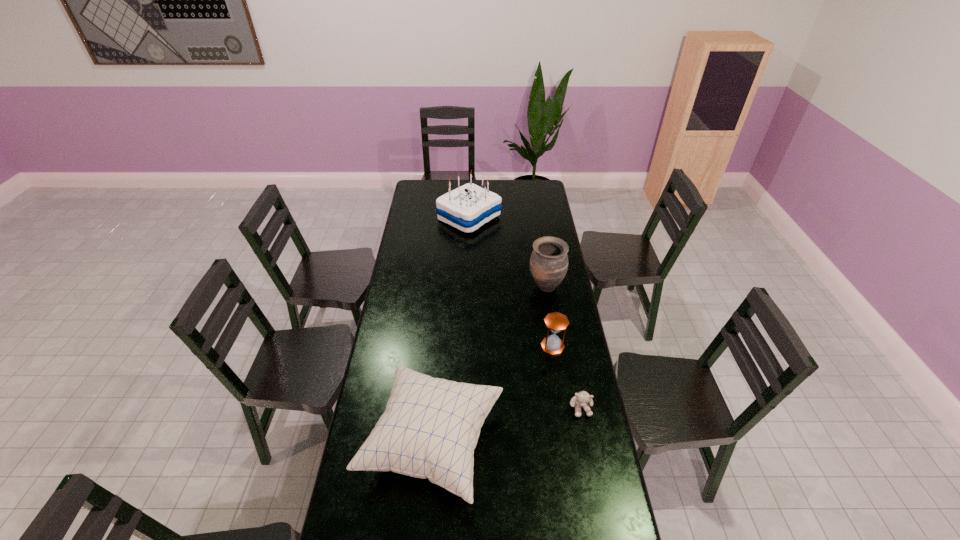
Where is `vacant area that lies between the teddy bear and the cushion`? vacant area that lies between the teddy bear and the cushion is located at coordinates (507, 425).

At what (x,y) coordinates should I click in order to perform the action: click on empty space that is in between the fourth tallest object and the farthest object. Please return your answer as a coordinate pair (x, y). This screenshot has width=960, height=540. Looking at the image, I should click on (511, 281).

You are a GUI agent. You are given a task and a screenshot of the screen. Output one action in this format:
    pyautogui.click(x=<x>, y=<y>)
    Task: Click on the vacant space that is in between the shortest object and the farthest object
    Image resolution: width=960 pixels, height=540 pixels.
    Given the screenshot: What is the action you would take?
    pyautogui.click(x=525, y=312)

Where is `free space between the fourth nearest object and the cushion`? This screenshot has width=960, height=540. free space between the fourth nearest object and the cushion is located at coordinates (490, 365).

At what (x,y) coordinates should I click in order to perform the action: click on free spot between the urn and the cushion. Please return your answer as a coordinate pair (x, y). Looking at the image, I should click on (490, 365).

Identify the location of free space between the hourglass and the birthday cake. Image resolution: width=960 pixels, height=540 pixels. (511, 281).

Identify which object is the third closest to the teddy bear. Please provide its 2D coordinates. Your answer should be formatted as a tuple, i.e. [(x, y)], where the tuple contains the x and y coordinates of a point satisfying the conditions above.

[(549, 260)]

At what (x,y) coordinates should I click in order to perform the action: click on object that is the closest to the cushion. Please return your answer as a coordinate pair (x, y). This screenshot has width=960, height=540. Looking at the image, I should click on (556, 322).

At what (x,y) coordinates should I click in order to perform the action: click on free location that satisfies the following two spatial constraints: 1. on the front side of the urn; 2. on the left side of the farthest object. Please return your answer as a coordinate pair (x, y). Looking at the image, I should click on (468, 287).

I want to click on vacant space that satisfies the following two spatial constraints: 1. on the back side of the urn; 2. on the left side of the cushion, so click(445, 287).